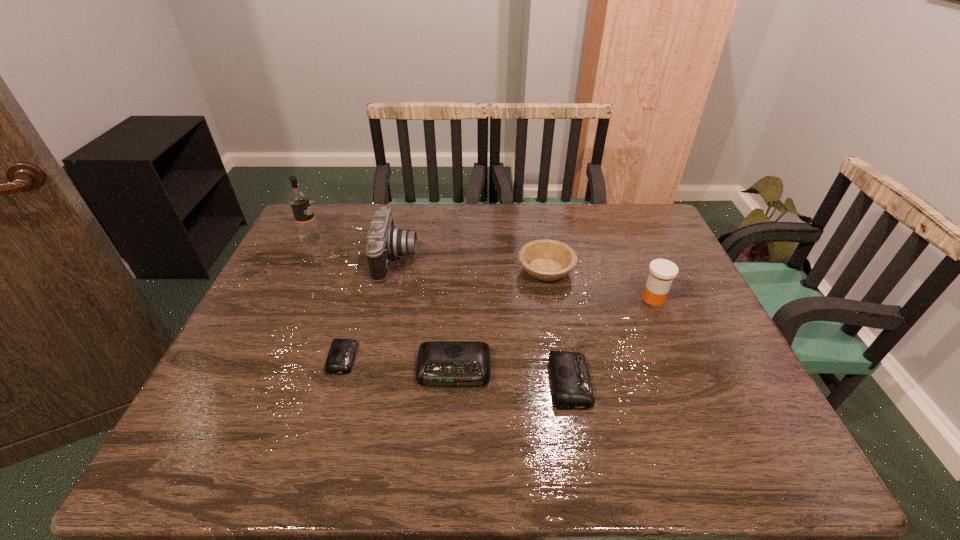
Locate an element on the screen. The image size is (960, 540). vacant area that lies between the leftmost object and the shortest object is located at coordinates (327, 298).

Identify the location of free space that is in between the tallest object and the fourth object from right to left. (383, 304).

Find the location of a particular element. Image resolution: width=960 pixels, height=540 pixels. empty location between the fourth shortest object and the medicine is located at coordinates (600, 285).

Locate an element on the screen. free point between the bowl and the second alarm clock from left to right is located at coordinates (500, 320).

The width and height of the screenshot is (960, 540). Identify the location of unoccupied position between the shortest alarm clock and the vodka. (327, 298).

The width and height of the screenshot is (960, 540). I want to click on vacant area that lies between the second tallest alarm clock and the fourth tallest object, so click(559, 326).

Locate an element on the screen. The height and width of the screenshot is (540, 960). free space between the second tallest object and the second shortest object is located at coordinates (484, 321).

Find the location of `free space between the fifth shortest object and the sixth shortest object`. free space between the fifth shortest object and the sixth shortest object is located at coordinates (525, 279).

Where is `free space that is in between the shortest alarm clock and the fourth shortest object`? free space that is in between the shortest alarm clock and the fourth shortest object is located at coordinates (444, 314).

The width and height of the screenshot is (960, 540). Find the location of `free area in between the tallest object and the shortest object`. free area in between the tallest object and the shortest object is located at coordinates (327, 298).